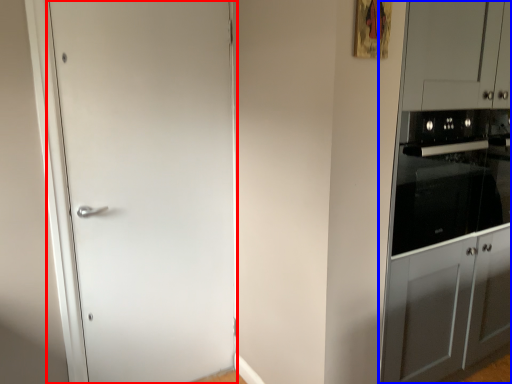
Question: Among these objects, which one is nearest to the camera, door (highlighted by a red box) or dresser (highlighted by a blue box)?

Choices:
 (A) door
 (B) dresser

Answer: (B)